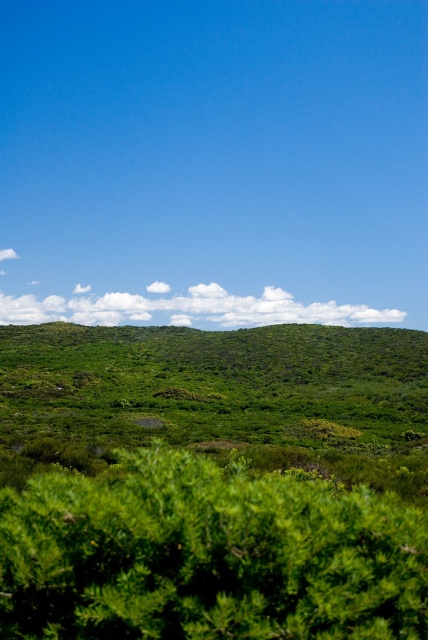
You are standing at the center of the image and want to walk towards the green leafy hillside at center. In which direction should you move?

Since the green leafy hillside at center is located at point coordinates of (213, 381), you should move towards the center of the image to reach it.

You are standing at the center of the image and want to locate the green leafy bush at center. According to the coordinates provided, in which direction should you look to find it?

The green leafy bush at center is located at coordinates point (208, 556), which means it is positioned to the right and slightly above the center point of the image. Therefore, you should look towards the upper right direction to find it.

You are an artist sketching the landscape. You notice the green leafy hillside at center and the white fluffy cloud at center. Which object appears smaller in the image?

The green leafy hillside at center appears smaller than the white fluffy cloud at center in the image.